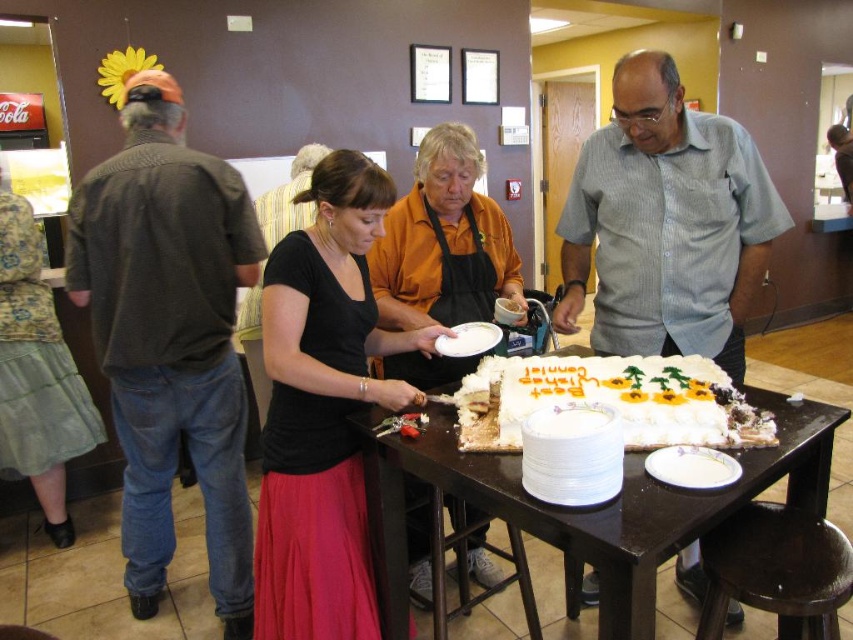
Question: Does black matte skirt at center appear on the left side of white frosted cake at center?

Choices:
 (A) yes
 (B) no

Answer: (A)

Question: Estimate the real-world distances between objects in this image. Which object is farther from the dark brown wooden stool at lower right?

Choices:
 (A) white frosted cake at center
 (B) white glossy cake at center
 (C) white ceramic plate at lower center
 (D) dark gray sweater at left

Answer: (D)

Question: Does gray striped shirt at center appear on the left side of white glossy cake at center?

Choices:
 (A) yes
 (B) no

Answer: (B)

Question: Is the position of black matte shirt at center more distant than that of white frosted cake at center?

Choices:
 (A) no
 (B) yes

Answer: (B)

Question: Which point is farther to the camera?

Choices:
 (A) dark brown wooden stool at lower right
 (B) black matte skirt at center

Answer: (B)

Question: Which object appears closest to the camera in this image?

Choices:
 (A) gray striped shirt at center
 (B) white glossy cake at center
 (C) white ceramic plate at lower center

Answer: (B)